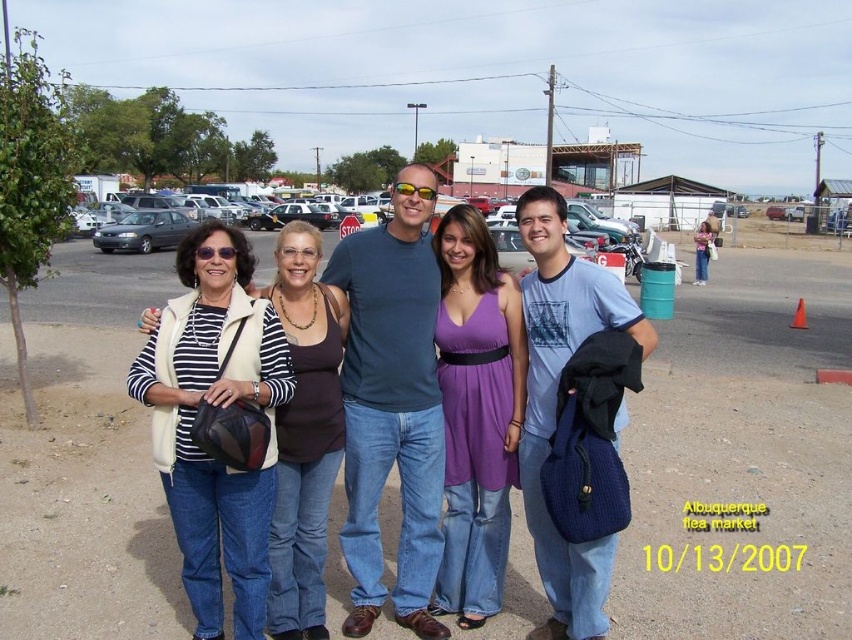
Does matte black bag at center have a smaller size compared to matte black car at center?

No, matte black bag at center is not smaller than matte black car at center.

Who is lower down, matte black bag at center or matte black car at center?

Positioned lower is matte black bag at center.

Is point (424, 332) positioned behind point (271, 228)?

No, (424, 332) is closer to viewer.

You are a GUI agent. You are given a task and a screenshot of the screen. Output one action in this format:
    pyautogui.click(x=<x>, y=<y>)
    Task: Click on the matte black bag at center
    The height and width of the screenshot is (640, 852).
    Given the screenshot: What is the action you would take?
    pyautogui.click(x=390, y=403)

Is matte gray sedan at left positioned at the back of matte black car at center?

That is False.

Is matte gray sedan at left wider than matte black car at center?

Indeed, matte gray sedan at left has a greater width compared to matte black car at center.

Between point (127, 236) and point (285, 212), which one is positioned behind?

The point (285, 212) is behind.

Find the location of a particular element. Image resolution: width=852 pixels, height=640 pixels. matte gray sedan at left is located at coordinates (144, 230).

From the picture: Is purple satin dress at center closer to camera compared to matte black car at center?

That is True.

Is purple satin dress at center bigger than matte black car at center?

Indeed, purple satin dress at center has a larger size compared to matte black car at center.

Which is behind, point (470, 234) or point (274, 218)?

Positioned behind is point (274, 218).

Locate an element on the screen. The width and height of the screenshot is (852, 640). purple satin dress at center is located at coordinates (476, 413).